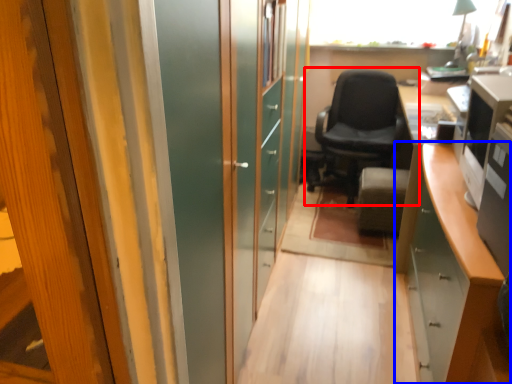
Question: Which object appears closest to the camera in this image, chair (highlighted by a red box) or cabinetry (highlighted by a blue box)?

Choices:
 (A) chair
 (B) cabinetry

Answer: (B)